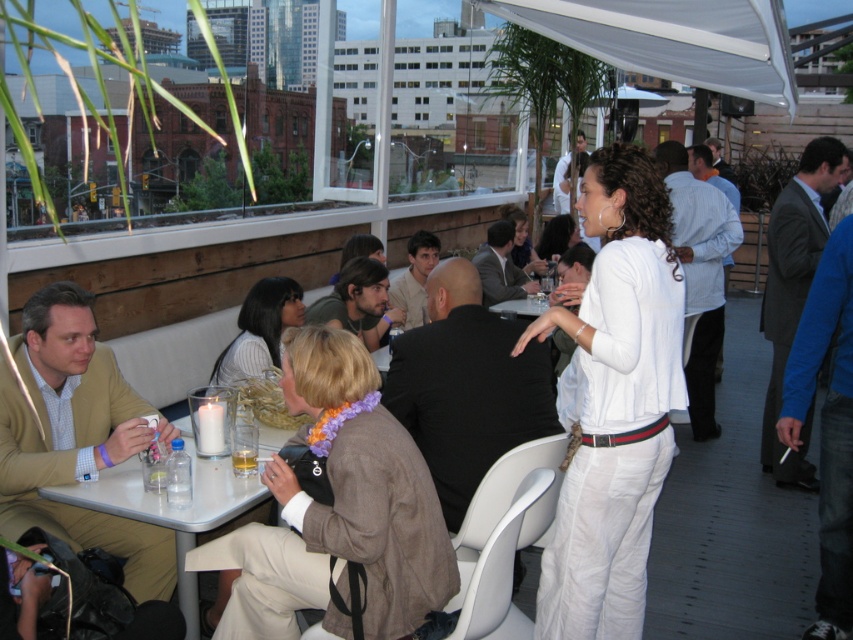
Consider the image. Can you confirm if beige textured blazer at left is taller than blue jeans at lower right?

Incorrect, beige textured blazer at left's height is not larger of blue jeans at lower right's.

Based on the photo, does beige textured blazer at left have a larger size compared to blue jeans at lower right?

Yes, beige textured blazer at left is bigger than blue jeans at lower right.

You are a GUI agent. You are given a task and a screenshot of the screen. Output one action in this format:
    pyautogui.click(x=<x>, y=<y>)
    Task: Click on the beige textured blazer at left
    
    Given the screenshot: What is the action you would take?
    pyautogui.click(x=74, y=436)

Can you confirm if black smooth suit at center is thinner than dark brown hair at center?

In fact, black smooth suit at center might be wider than dark brown hair at center.

The height and width of the screenshot is (640, 853). Describe the element at coordinates (466, 387) in the screenshot. I see `black smooth suit at center` at that location.

This screenshot has height=640, width=853. I want to click on black smooth suit at center, so pyautogui.click(x=466, y=387).

Which is behind, point (486, 256) or point (723, 160)?

Positioned behind is point (723, 160).

Can you confirm if matte black suit at center is positioned below dark brown leather jacket at upper right?

Yes, matte black suit at center is below dark brown leather jacket at upper right.

Does point (503, 262) lie behind point (711, 145)?

That is False.

Where is `matte black suit at center`? matte black suit at center is located at coordinates (500, 266).